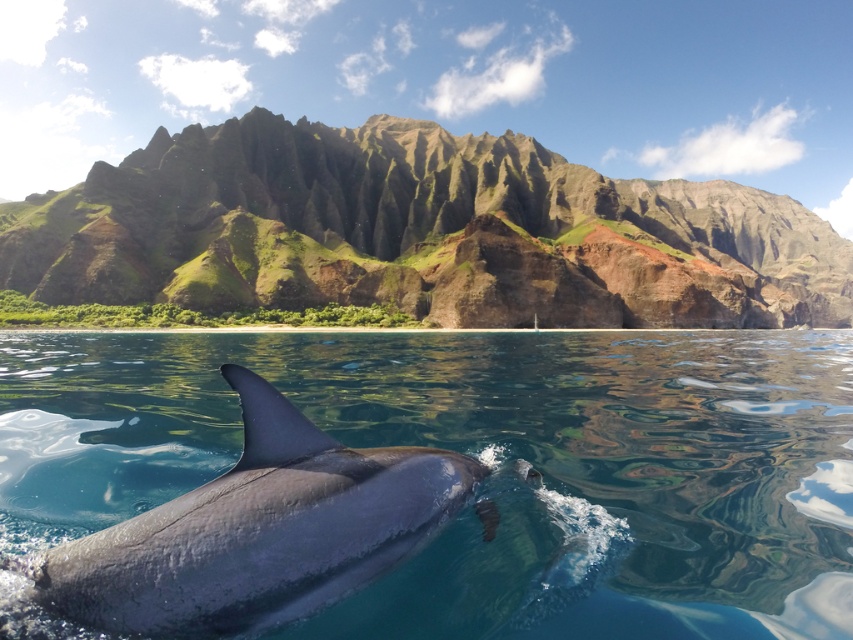
Question: Which point is closer to the camera?

Choices:
 (A) (254, 444)
 (B) (175, 627)

Answer: (B)

Question: Observing the image, what is the correct spatial positioning of smooth gray dolphin at center in reference to gray matte fin at lower center?

Choices:
 (A) right
 (B) left

Answer: (A)

Question: Is smooth gray dolphin at center smaller than gray matte fin at lower center?

Choices:
 (A) yes
 (B) no

Answer: (B)

Question: From the image, what is the correct spatial relationship of smooth gray dolphin at center in relation to gray matte fin at lower center?

Choices:
 (A) below
 (B) above

Answer: (A)

Question: Which point is farther to the camera?

Choices:
 (A) (318, 460)
 (B) (267, 390)

Answer: (A)